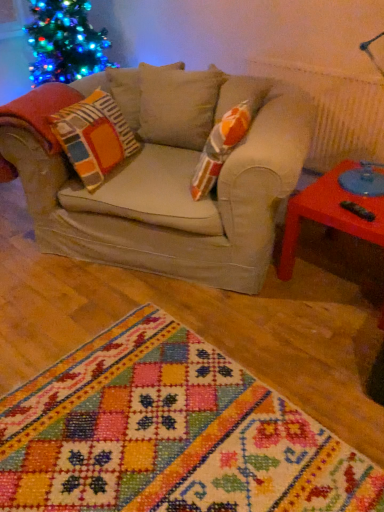
Question: Is rubberized plastic table at right at the back of multicolored woven rug at center?

Choices:
 (A) yes
 (B) no

Answer: (B)

Question: Does multicolored woven rug at center have a lesser width compared to rubberized plastic table at right?

Choices:
 (A) no
 (B) yes

Answer: (A)

Question: Does multicolored woven rug at center touch rubberized plastic table at right?

Choices:
 (A) no
 (B) yes

Answer: (A)

Question: From a real-world perspective, is multicolored woven rug at center under rubberized plastic table at right?

Choices:
 (A) no
 (B) yes

Answer: (B)

Question: Can you confirm if multicolored woven rug at center is shorter than rubberized plastic table at right?

Choices:
 (A) no
 (B) yes

Answer: (B)

Question: Does multicolored woven rug at center have a greater height compared to rubberized plastic table at right?

Choices:
 (A) no
 (B) yes

Answer: (A)

Question: Are rubberized plastic table at right and multicolored woven rug at center making contact?

Choices:
 (A) no
 (B) yes

Answer: (A)

Question: From a real-world perspective, is rubberized plastic table at right below multicolored woven rug at center?

Choices:
 (A) yes
 (B) no

Answer: (B)

Question: Does rubberized plastic table at right have a greater width compared to multicolored woven rug at center?

Choices:
 (A) yes
 (B) no

Answer: (B)

Question: Is rubberized plastic table at right positioned before multicolored woven rug at center?

Choices:
 (A) no
 (B) yes

Answer: (A)

Question: Is rubberized plastic table at right at the left side of multicolored woven rug at center?

Choices:
 (A) yes
 (B) no

Answer: (B)

Question: Could you tell me if rubberized plastic table at right is turned towards multicolored woven rug at center?

Choices:
 (A) yes
 (B) no

Answer: (B)

Question: From their relative heights in the image, would you say rubberized plastic table at right is taller or shorter than multicolored woven rug at center?

Choices:
 (A) short
 (B) tall

Answer: (B)